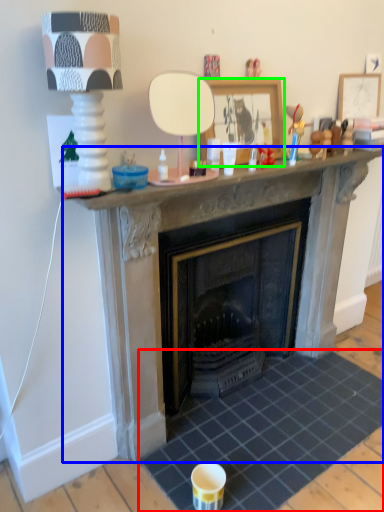
Question: Which is nearer to the tile (highlighted by a red box)? fireplace (highlighted by a blue box) or picture frame (highlighted by a green box).

Choices:
 (A) fireplace
 (B) picture frame

Answer: (A)